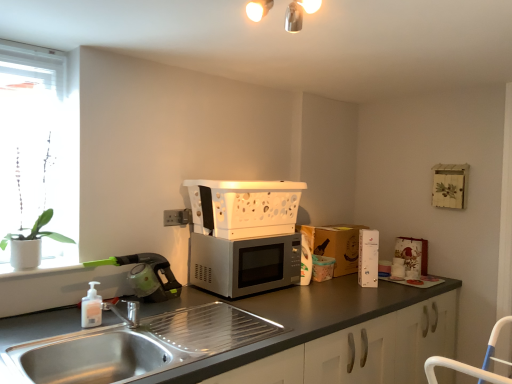
Find the location of `free location to the left of white matte soap dispenser at sink left`. free location to the left of white matte soap dispenser at sink left is located at coordinates (51, 319).